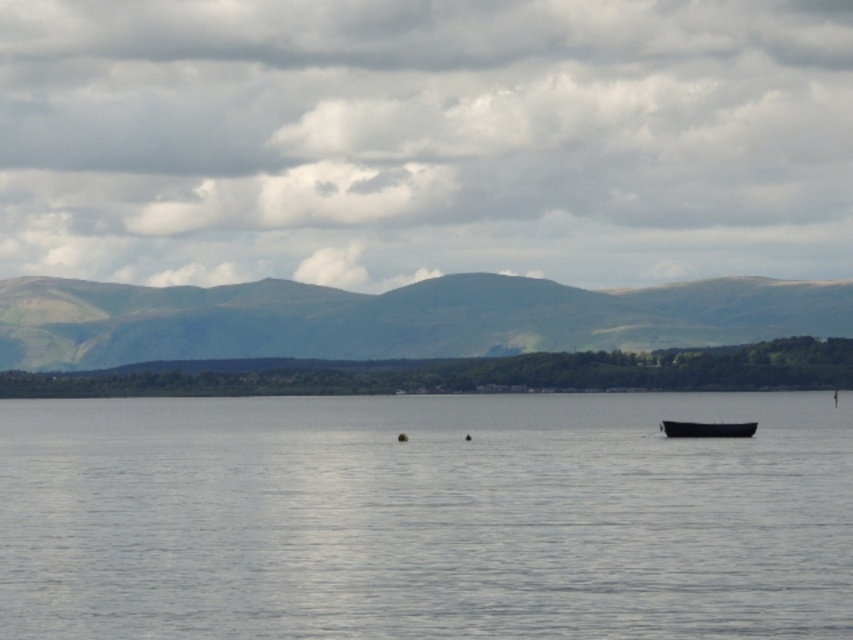
Question: Which point appears farthest from the camera in this image?

Choices:
 (A) (602, 524)
 (B) (466, 291)
 (C) (671, 426)

Answer: (B)

Question: Is smooth gray water at center further to camera compared to black matte boat at center?

Choices:
 (A) no
 (B) yes

Answer: (A)

Question: Which point appears farthest from the camera in this image?

Choices:
 (A) (524, 608)
 (B) (682, 428)

Answer: (B)

Question: Which of these objects is positioned farthest from the green grassy mountain at center?

Choices:
 (A) black matte boat at center
 (B) smooth gray water at center

Answer: (A)

Question: Does smooth gray water at center have a larger size compared to black matte boat at center?

Choices:
 (A) yes
 (B) no

Answer: (A)

Question: Does smooth gray water at center appear on the left side of black matte boat at center?

Choices:
 (A) yes
 (B) no

Answer: (A)